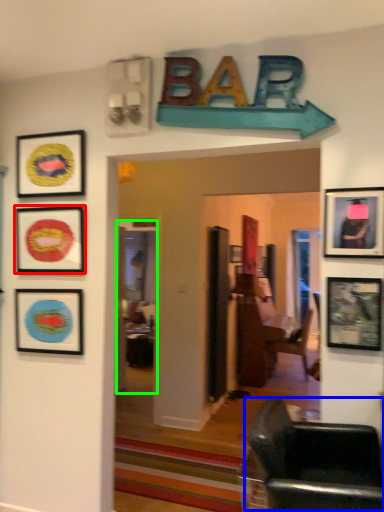
Question: Estimate the real-world distances between objects in this image. Which object is closer to picture frame (highlighted by a red box), chair (highlighted by a blue box) or glass door (highlighted by a green box)?

Choices:
 (A) chair
 (B) glass door

Answer: (A)